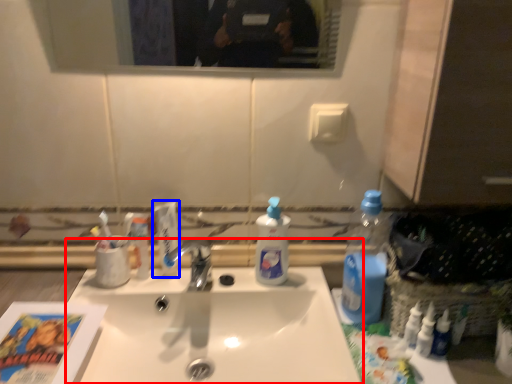
Question: Which object appears closest to the camera in this image, sink (highlighted by a red box) or toothpaste (highlighted by a blue box)?

Choices:
 (A) sink
 (B) toothpaste

Answer: (A)